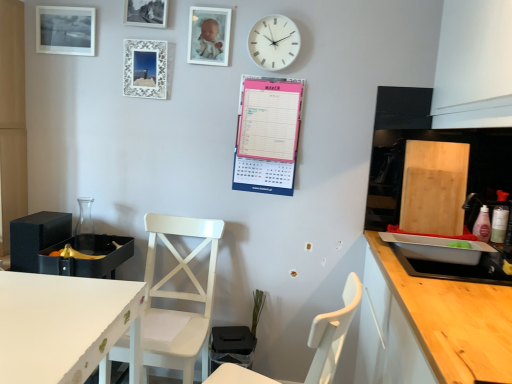
Question: Which direction should I rotate to look at white glossy picture frame at upper center, which ranks as the fourth picture frame in left-to-right order, — up or down?

Choices:
 (A) up
 (B) down

Answer: (A)

Question: Can you confirm if white glossy picture frame at upper center, which is the first picture frame in right-to-left order, is wider than white plastic wall clock at upper center?

Choices:
 (A) yes
 (B) no

Answer: (B)

Question: Could white plastic wall clock at upper center be considered to be inside white glossy picture frame at upper center, which is the first picture frame in right-to-left order?

Choices:
 (A) yes
 (B) no

Answer: (B)

Question: Is white glossy picture frame at upper center, which ranks as the fourth picture frame in left-to-right order, not near white plastic wall clock at upper center?

Choices:
 (A) yes
 (B) no

Answer: (B)

Question: From a real-world perspective, is white glossy picture frame at upper center, which ranks as the fourth picture frame in left-to-right order, under white plastic wall clock at upper center?

Choices:
 (A) no
 (B) yes

Answer: (A)

Question: From the image's perspective, is white glossy picture frame at upper center, which ranks as the fourth picture frame in left-to-right order, on white plastic wall clock at upper center?

Choices:
 (A) no
 (B) yes

Answer: (B)

Question: Is white glossy picture frame at upper center, which ranks as the fourth picture frame in left-to-right order, oriented towards white plastic wall clock at upper center?

Choices:
 (A) no
 (B) yes

Answer: (A)

Question: Is wooden countertop at right completely or partially outside of matte black picture frame at upper left, acting as the first picture frame starting from the left?

Choices:
 (A) yes
 (B) no

Answer: (A)

Question: Is wooden countertop at right further to camera compared to matte black picture frame at upper left, the fourth picture frame in the right-to-left sequence?

Choices:
 (A) yes
 (B) no

Answer: (B)

Question: Does wooden countertop at right appear on the left side of matte black picture frame at upper left, the fourth picture frame in the right-to-left sequence?

Choices:
 (A) no
 (B) yes

Answer: (A)

Question: Is wooden countertop at right bigger than matte black picture frame at upper left, acting as the first picture frame starting from the left?

Choices:
 (A) no
 (B) yes

Answer: (B)

Question: Considering the relative sizes of wooden countertop at right and matte black picture frame at upper left, acting as the first picture frame starting from the left, in the image provided, is wooden countertop at right smaller than matte black picture frame at upper left, acting as the first picture frame starting from the left,?

Choices:
 (A) no
 (B) yes

Answer: (A)

Question: Is wooden countertop at right positioned before matte black picture frame at upper left, acting as the first picture frame starting from the left?

Choices:
 (A) no
 (B) yes

Answer: (B)

Question: Can you confirm if metallic silver picture frame at upper center, which is the third picture frame from left to right, is taller than wooden countertop at right?

Choices:
 (A) no
 (B) yes

Answer: (A)